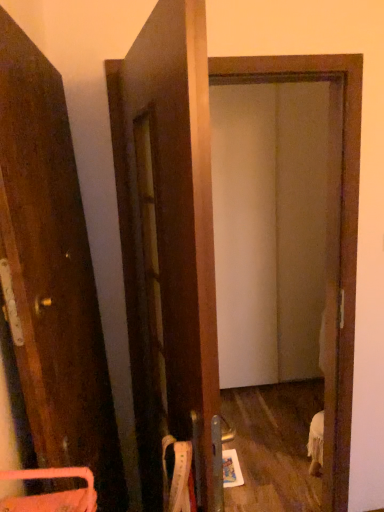
Identify the location of transparent glass screen door at center. (341, 206).

The width and height of the screenshot is (384, 512). Describe the element at coordinates (341, 206) in the screenshot. I see `transparent glass screen door at center` at that location.

Find the location of a particular element. The width and height of the screenshot is (384, 512). transparent glass screen door at center is located at coordinates (341, 206).